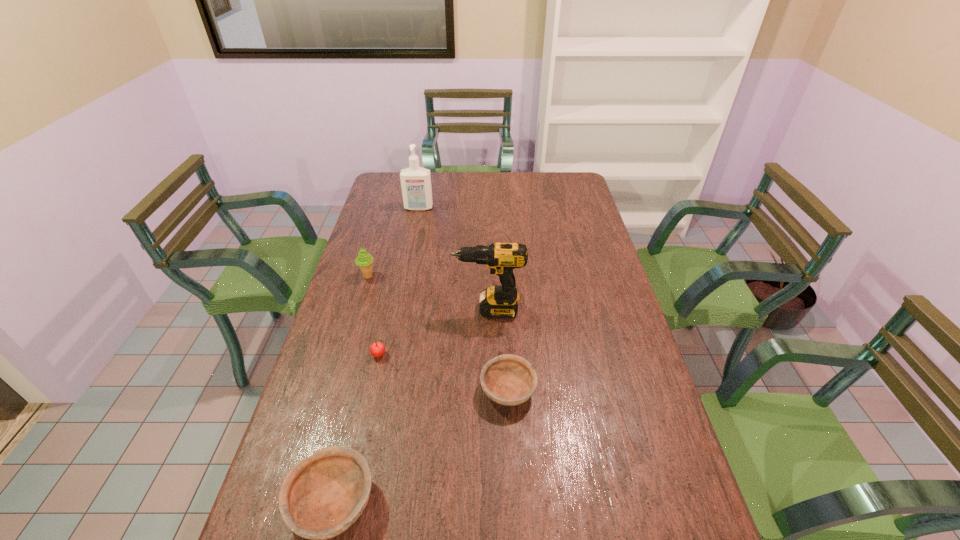
Identify the location of vacant region located on the front of the icecream. (338, 376).

Locate an element on the screen. vacant space located at the tip of the fourth nearest object is located at coordinates (385, 309).

The image size is (960, 540). I want to click on vacant region located at the tip of the fourth nearest object, so click(x=413, y=309).

Identify the location of vacant region located 0.060m at the tip of the fourth nearest object. The height and width of the screenshot is (540, 960). (435, 309).

Identify the location of free location located 0.340m on the back of the fourth farthest object. The image size is (960, 540). (397, 274).

Where is `cleansing agent situated at the left edge`? cleansing agent situated at the left edge is located at coordinates (415, 181).

The height and width of the screenshot is (540, 960). What are the coordinates of `icecream at the left edge` in the screenshot? It's located at (364, 260).

Locate an element on the screen. cherry positioned at the left edge is located at coordinates (377, 349).

Identify the location of vacant space at the far edge. The image size is (960, 540). (478, 179).

Find the location of `vacant space at the left edge of the desktop`. vacant space at the left edge of the desktop is located at coordinates (368, 378).